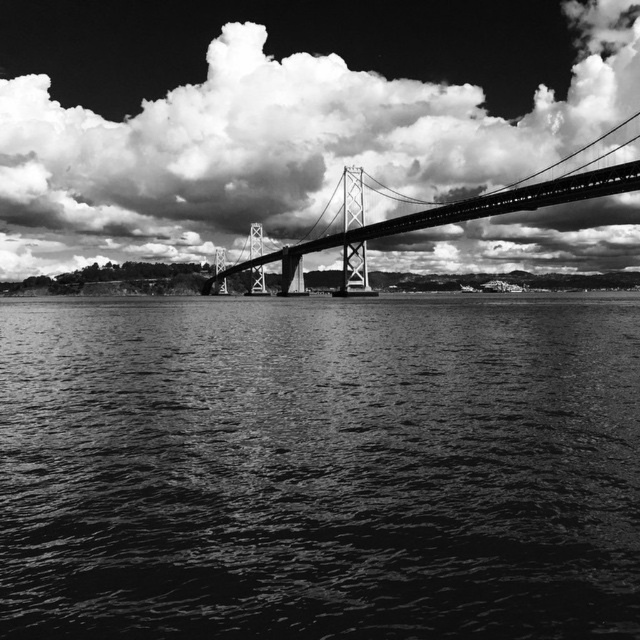
Question: Does cloudy sky at upper center have a larger size compared to metallic bridge at center?

Choices:
 (A) yes
 (B) no

Answer: (A)

Question: Considering the real-world distances, which object is farthest from the cloudy sky at upper center?

Choices:
 (A) dark water at center
 (B) metallic bridge at center

Answer: (A)

Question: Does dark water at center come behind metallic bridge at center?

Choices:
 (A) no
 (B) yes

Answer: (A)

Question: Estimate the real-world distances between objects in this image. Which object is closer to the cloudy sky at upper center?

Choices:
 (A) dark water at center
 (B) metallic bridge at center

Answer: (B)

Question: Is dark water at center above metallic bridge at center?

Choices:
 (A) yes
 (B) no

Answer: (B)

Question: Which is nearer to the dark water at center?

Choices:
 (A) cloudy sky at upper center
 (B) metallic bridge at center

Answer: (B)